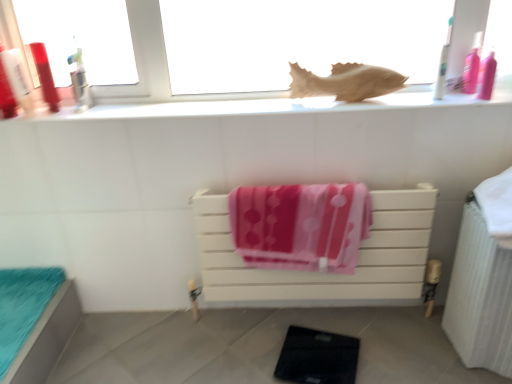
Question: Does point (301, 82) appear closer or farther from the camera than point (78, 301)?

Choices:
 (A) farther
 (B) closer

Answer: (B)

Question: Considering the positions of wooden fish at upper center and teal fabric cushion at lower left, which is the 2th furniture from right to left, in the image, is wooden fish at upper center bigger or smaller than teal fabric cushion at lower left, which is the 2th furniture from right to left,?

Choices:
 (A) big
 (B) small

Answer: (A)

Question: Which object is positioned farthest from the matte plastic toothbrush at upper left, arranged as the third toiletry when viewed from the right?

Choices:
 (A) pink plastic bottle at upper right, the first toiletry from the right
 (B) white wooden towel rack at center, the second furniture from the left
 (C) teal fabric cushion at lower left, placed as the 1th furniture when sorted from left to right
 (D) matte plastic bottle at left, the 1th toiletry viewed from the left
 (E) white plastic toothbrush at upper right, the second toiletry viewed from the right

Answer: (A)

Question: Estimate the real-world distances between objects in this image. Which object is closer to the teal fabric cushion at lower left, placed as the 1th furniture when sorted from left to right?

Choices:
 (A) white plastic toothbrush at upper right, the second toiletry viewed from the right
 (B) white wooden towel rack at center, the first furniture positioned from the right
 (C) wooden fish at upper center
 (D) matte plastic toothbrush at upper left, arranged as the third toiletry when viewed from the right
 (E) white ceramic window sill at upper center

Answer: (D)